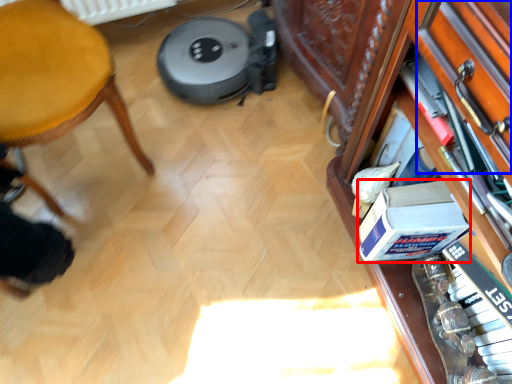
Question: Which object is closer to the camera taking this photo, box (highlighted by a red box) or drawer (highlighted by a blue box)?

Choices:
 (A) box
 (B) drawer

Answer: (B)